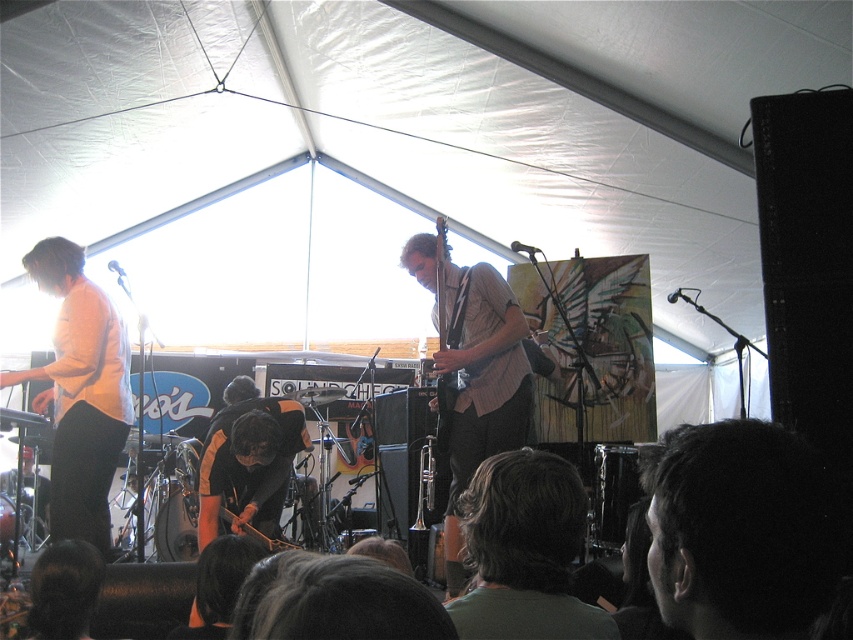
Is light brown textured shirt at center to the left of wooden acoustic guitar at center from the viewer's perspective?

Indeed, light brown textured shirt at center is positioned on the left side of wooden acoustic guitar at center.

Which of these two, light brown textured shirt at center or wooden acoustic guitar at center, stands shorter?

wooden acoustic guitar at center is shorter.

You are a GUI agent. You are given a task and a screenshot of the screen. Output one action in this format:
    pyautogui.click(x=<x>, y=<y>)
    Task: Click on the light brown textured shirt at center
    The width and height of the screenshot is (853, 640).
    Given the screenshot: What is the action you would take?
    pyautogui.click(x=473, y=369)

The width and height of the screenshot is (853, 640). In order to click on light brown textured shirt at center in this screenshot , I will do `click(473, 369)`.

Which is above, dark brown hair at lower center or light brown textured shirt at center?

light brown textured shirt at center is above.

Does dark brown hair at lower center appear over light brown textured shirt at center?

Incorrect, dark brown hair at lower center is not positioned above light brown textured shirt at center.

Between point (498, 536) and point (497, 304), which one is positioned in front?

Positioned in front is point (498, 536).

Where is `dark brown hair at lower center`? dark brown hair at lower center is located at coordinates (524, 552).

Is dark hair at lower right to the left of light brown textured shirt at center from the viewer's perspective?

No, dark hair at lower right is not to the left of light brown textured shirt at center.

Can you confirm if dark hair at lower right is positioned to the right of light brown textured shirt at center?

Yes, dark hair at lower right is to the right of light brown textured shirt at center.

In order to click on dark hair at lower right in this screenshot , I will do coord(741,531).

Identify the location of dark hair at lower right. (741, 531).